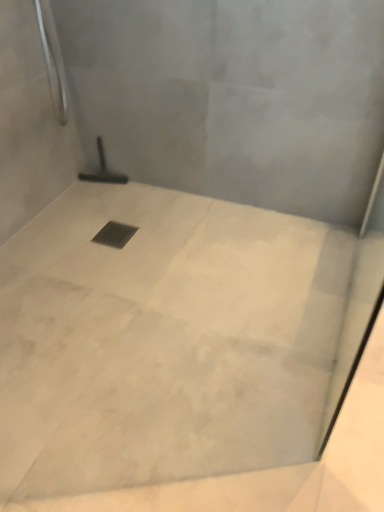
Where is `vacant space to the right of black rubber squeegee at center`? The image size is (384, 512). vacant space to the right of black rubber squeegee at center is located at coordinates (153, 194).